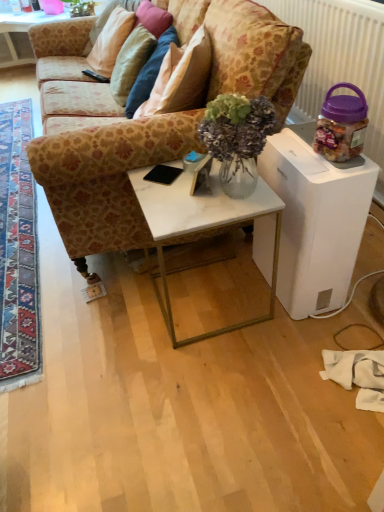
The width and height of the screenshot is (384, 512). I want to click on free space above carpeted rug at lower left (from a real-world perspective), so click(9, 163).